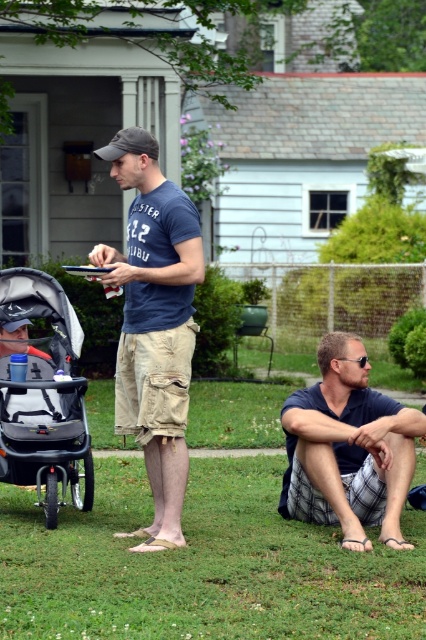
Question: Is gray fabric stroller at left to the right of matte gray baseball cap at center from the viewer's perspective?

Choices:
 (A) yes
 (B) no

Answer: (B)

Question: Which of the following is the farthest from the observer?

Choices:
 (A) matte gray baseball cap at center
 (B) matte blue t-shirt at center
 (C) gray fabric stroller at left

Answer: (C)

Question: Is dark blue shirt at lower right to the left of matte gray baseball cap at center from the viewer's perspective?

Choices:
 (A) no
 (B) yes

Answer: (A)

Question: Can you confirm if gray fabric stroller at left is positioned below matte gray baseball cap at center?

Choices:
 (A) yes
 (B) no

Answer: (A)

Question: Among these points, which one is nearest to the camera?

Choices:
 (A) (138, 132)
 (B) (85, 388)
 (C) (164, 195)
 (D) (351, 403)

Answer: (C)

Question: Based on their relative distances, which object is farther from the matte blue t-shirt at center?

Choices:
 (A) gray fabric stroller at left
 (B) dark blue shirt at lower right

Answer: (B)